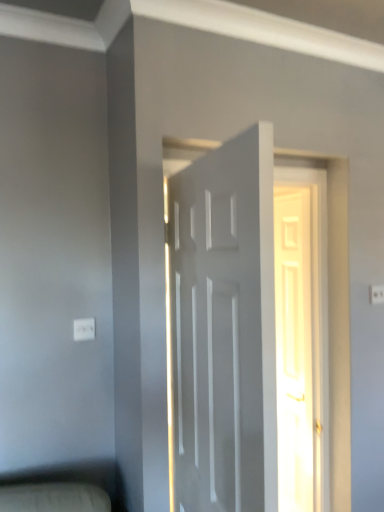
Question: Is white matte door at center, the 2th door viewed from the back, thinner than white plastic electric outlet at lower left, which is the first electric outlet from bottom to top?

Choices:
 (A) no
 (B) yes

Answer: (A)

Question: Is white matte door at center, positioned as the 2th door in right-to-left order, far away from white plastic electric outlet at lower left, which is the 2th electric outlet in top-to-bottom order?

Choices:
 (A) no
 (B) yes

Answer: (A)

Question: Considering the relative positions of white matte door at center, which is the first door from left to right, and white plastic electric outlet at lower left, which is the 2th electric outlet in top-to-bottom order, in the image provided, is white matte door at center, which is the first door from left to right, to the left of white plastic electric outlet at lower left, which is the 2th electric outlet in top-to-bottom order, from the viewer's perspective?

Choices:
 (A) yes
 (B) no

Answer: (B)

Question: Can you confirm if white matte door at center, marked as the first door in a front-to-back arrangement, is positioned to the right of white plastic electric outlet at lower left, which is the 2th electric outlet in top-to-bottom order?

Choices:
 (A) yes
 (B) no

Answer: (A)

Question: From the image's perspective, is white matte door at center, positioned as the 2th door in right-to-left order, on top of white plastic electric outlet at lower left, which is the first electric outlet from bottom to top?

Choices:
 (A) no
 (B) yes

Answer: (A)

Question: From the image's perspective, is white matte door at center, positioned as the 2th door in right-to-left order, positioned above or below white plastic electric outlet at lower left, which is the second electric outlet in back-to-front order?

Choices:
 (A) below
 (B) above

Answer: (A)

Question: In terms of width, does white matte door at center, the 2th door viewed from the back, look wider or thinner when compared to white plastic electric outlet at lower left, placed as the second electric outlet when sorted from right to left?

Choices:
 (A) thin
 (B) wide

Answer: (B)

Question: In the image, is white matte door at center, marked as the first door in a front-to-back arrangement, positioned in front of or behind white plastic electric outlet at lower left, which is the 2th electric outlet in top-to-bottom order?

Choices:
 (A) behind
 (B) front

Answer: (B)

Question: Looking at the image, does white matte door at center, the 2th door viewed from the back, seem bigger or smaller compared to white plastic electric outlet at lower left, which is counted as the first electric outlet, starting from the front?

Choices:
 (A) small
 (B) big

Answer: (B)

Question: Considering their positions, is white plastic electric outlet at lower left, which is the 2th electric outlet in top-to-bottom order, located in front of or behind white glossy door at center, placed as the first door when sorted from back to front?

Choices:
 (A) front
 (B) behind

Answer: (A)

Question: From the image's perspective, is white plastic electric outlet at lower left, which is the first electric outlet from bottom to top, located above or below white glossy door at center, the first door viewed from the right?

Choices:
 (A) below
 (B) above

Answer: (B)

Question: Considering the positions of point (84, 326) and point (289, 186), is point (84, 326) closer or farther from the camera than point (289, 186)?

Choices:
 (A) farther
 (B) closer

Answer: (B)

Question: Do you think white plastic electric outlet at lower left, which is counted as the first electric outlet, starting from the front, is within white glossy door at center, the second door when ordered from front to back, or outside of it?

Choices:
 (A) outside
 (B) inside

Answer: (A)

Question: From a real-world perspective, relative to white plastic electric outlet at upper right, positioned as the first electric outlet in right-to-left order, is white glossy door at center, the first door viewed from the right, vertically above or below?

Choices:
 (A) below
 (B) above

Answer: (A)

Question: Looking at their shapes, would you say white glossy door at center, which ranks as the second door in left-to-right order, is wider or thinner than white plastic electric outlet at upper right, which appears as the first electric outlet when viewed from the top?

Choices:
 (A) wide
 (B) thin

Answer: (A)